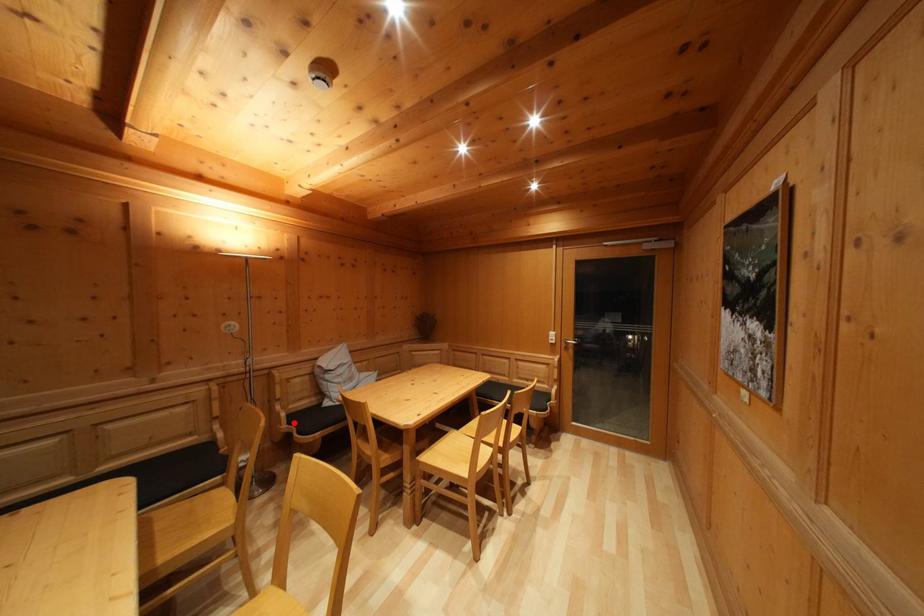
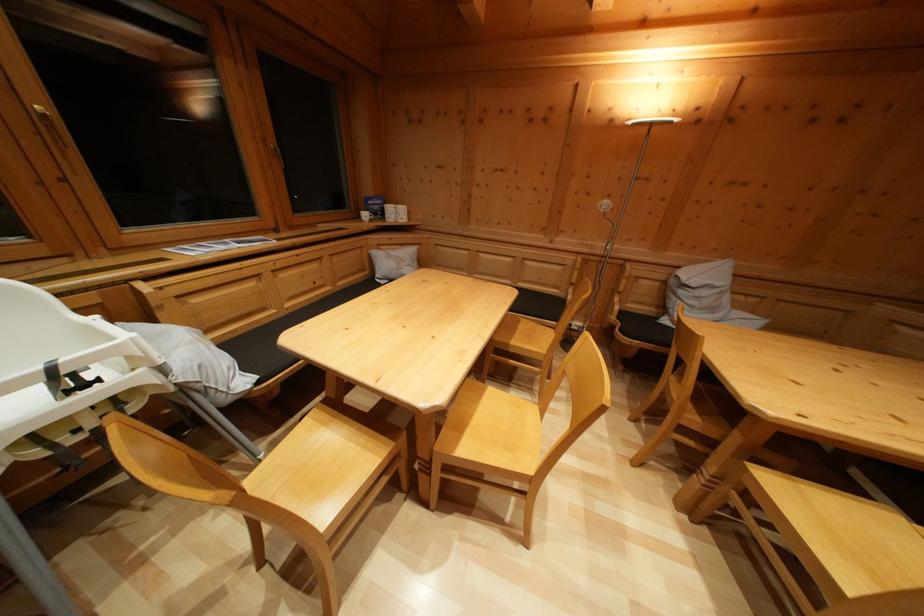
Where in the second image is the point corresponding to the highlighted location from the first image?

(626, 318)